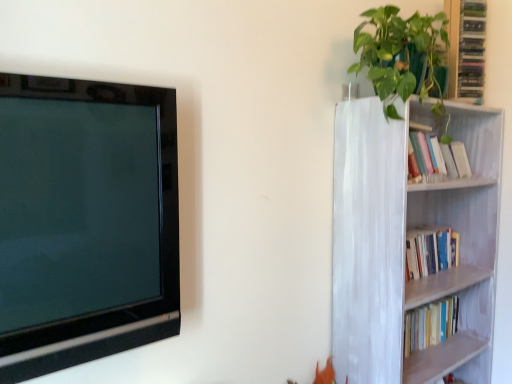
What do you see at coordinates (399, 54) in the screenshot? The height and width of the screenshot is (384, 512). I see `green glossy plant at upper right` at bounding box center [399, 54].

This screenshot has height=384, width=512. What do you see at coordinates (85, 221) in the screenshot?
I see `black glossy television at left` at bounding box center [85, 221].

What are the coordinates of `green glossy cabinet at upper right` in the screenshot? It's located at (466, 48).

The height and width of the screenshot is (384, 512). I want to click on green glossy plant at upper right, so click(399, 54).

Considering the relative positions of white painted wood bookcase at right and green glossy plant at upper right in the image provided, is white painted wood bookcase at right behind green glossy plant at upper right?

Yes, the depth of white painted wood bookcase at right is greater than that of green glossy plant at upper right.

Considering the sizes of white painted wood bookcase at right and green glossy plant at upper right in the image, is white painted wood bookcase at right taller or shorter than green glossy plant at upper right?

Clearly, white painted wood bookcase at right is taller compared to green glossy plant at upper right.

Who is bigger, white painted wood bookcase at right or green glossy plant at upper right?

With larger size is white painted wood bookcase at right.

Considering the relative sizes of white painted wood bookcase at right and green glossy plant at upper right in the image provided, is white painted wood bookcase at right wider than green glossy plant at upper right?

Yes, white painted wood bookcase at right is wider than green glossy plant at upper right.

From the image's perspective, which is below, green glossy plant at upper right or black glossy television at left?

black glossy television at left appears lower in the image.

From a real-world perspective, is green glossy plant at upper right under black glossy television at left?

No, from a real-world perspective, green glossy plant at upper right is not below black glossy television at left.

In the scene shown: From the image's perspective, is white painted wood bookcase at right positioned above or below green glossy cabinet at upper right?

white painted wood bookcase at right is below green glossy cabinet at upper right.

Are white painted wood bookcase at right and green glossy cabinet at upper right beside each other?

white painted wood bookcase at right is not next to green glossy cabinet at upper right, and they're not touching.

Can green glossy cabinet at upper right be found inside white painted wood bookcase at right?

Actually, green glossy cabinet at upper right is outside white painted wood bookcase at right.

Measure the distance from white painted wood bookcase at right to green glossy cabinet at upper right.

white painted wood bookcase at right and green glossy cabinet at upper right are 20.75 inches apart from each other.

Would you say green glossy plant at upper right contains green glossy cabinet at upper right?

No, green glossy cabinet at upper right is located outside of green glossy plant at upper right.

Between green glossy plant at upper right and green glossy cabinet at upper right, which one appears on the left side from the viewer's perspective?

green glossy plant at upper right is more to the left.

Measure the distance between green glossy plant at upper right and green glossy cabinet at upper right.

green glossy plant at upper right and green glossy cabinet at upper right are 32.39 centimeters apart.

Is green glossy plant at upper right placed right next to green glossy cabinet at upper right?

No, green glossy plant at upper right is not next to green glossy cabinet at upper right.

What are the coordinates of `television above the white painted wood bookcase at right (from the image's perspective)` in the screenshot? It's located at (85, 221).

From their relative heights in the image, would you say white painted wood bookcase at right is taller or shorter than black glossy television at left?

Clearly, white painted wood bookcase at right is taller compared to black glossy television at left.

Is point (352, 287) in front of point (21, 96)?

No, it is behind (21, 96).

Is white painted wood bookcase at right further to camera compared to black glossy television at left?

That is True.

Which of these two, green glossy cabinet at upper right or black glossy television at left, stands shorter?

green glossy cabinet at upper right.

You are a GUI agent. You are given a task and a screenshot of the screen. Output one action in this format:
    pyautogui.click(x=<x>, y=<y>)
    Task: Click on the cabinet that appears behind the black glossy television at left
    The height and width of the screenshot is (384, 512).
    Given the screenshot: What is the action you would take?
    pyautogui.click(x=466, y=48)

Find the location of `houseplant that appears below the green glossy cabinet at upper right (from the image's perspective)`. houseplant that appears below the green glossy cabinet at upper right (from the image's perspective) is located at coordinates (399, 54).

Is green glossy cabinet at upper right placed right next to green glossy plant at upper right?

green glossy cabinet at upper right and green glossy plant at upper right are not in contact.

Considering the relative sizes of green glossy cabinet at upper right and green glossy plant at upper right in the image provided, is green glossy cabinet at upper right shorter than green glossy plant at upper right?

Yes, green glossy cabinet at upper right is shorter than green glossy plant at upper right.

Measure the distance from green glossy cabinet at upper right to green glossy plant at upper right.

The distance of green glossy cabinet at upper right from green glossy plant at upper right is 12.75 inches.

Where is `bookcase lying on the right of green glossy plant at upper right`? bookcase lying on the right of green glossy plant at upper right is located at coordinates (405, 243).

Locate an element on the screen. houseplant lying above the black glossy television at left (from the image's perspective) is located at coordinates (399, 54).

Looking at the image, which one is located further to white painted wood bookcase at right, green glossy plant at upper right or black glossy television at left?

Among the two, black glossy television at left is located further to white painted wood bookcase at right.

Which object lies further to the anchor point black glossy television at left, white painted wood bookcase at right or green glossy plant at upper right?

white painted wood bookcase at right.

Estimate the real-world distances between objects in this image. Which object is closer to black glossy television at left, white painted wood bookcase at right or green glossy cabinet at upper right?

white painted wood bookcase at right is closer to black glossy television at left.

Considering their positions, is black glossy television at left positioned further to green glossy cabinet at upper right than green glossy plant at upper right?

black glossy television at left is positioned further to the anchor green glossy cabinet at upper right.

Considering their positions, is green glossy plant at upper right positioned further to white painted wood bookcase at right than green glossy cabinet at upper right?

Based on the image, green glossy plant at upper right appears to be further to white painted wood bookcase at right.

Looking at the image, which one is located further to black glossy television at left, green glossy cabinet at upper right or white painted wood bookcase at right?

Based on the image, green glossy cabinet at upper right appears to be further to black glossy television at left.

From the image, which object appears to be nearer to green glossy plant at upper right, black glossy television at left or white painted wood bookcase at right?

The object closer to green glossy plant at upper right is white painted wood bookcase at right.

Looking at this image, estimate the real-world distances between objects in this image. Which object is closer to green glossy cabinet at upper right, green glossy plant at upper right or white painted wood bookcase at right?

Among the two, green glossy plant at upper right is located nearer to green glossy cabinet at upper right.

Locate an element on the screen. bookcase between black glossy television at left and green glossy cabinet at upper right in the horizontal direction is located at coordinates (405, 243).

Find the location of `houseplant situated between black glossy television at left and green glossy cabinet at upper right from left to right`. houseplant situated between black glossy television at left and green glossy cabinet at upper right from left to right is located at coordinates (399, 54).

You are a GUI agent. You are given a task and a screenshot of the screen. Output one action in this format:
    pyautogui.click(x=<x>, y=<y>)
    Task: Click on the houseplant between green glossy cabinet at upper right and white painted wood bookcase at right from top to bottom
    
    Given the screenshot: What is the action you would take?
    pyautogui.click(x=399, y=54)

At what (x,y) coordinates should I click in order to perform the action: click on houseplant between black glossy television at left and white painted wood bookcase at right in the horizontal direction. Please return your answer as a coordinate pair (x, y). Looking at the image, I should click on (399, 54).